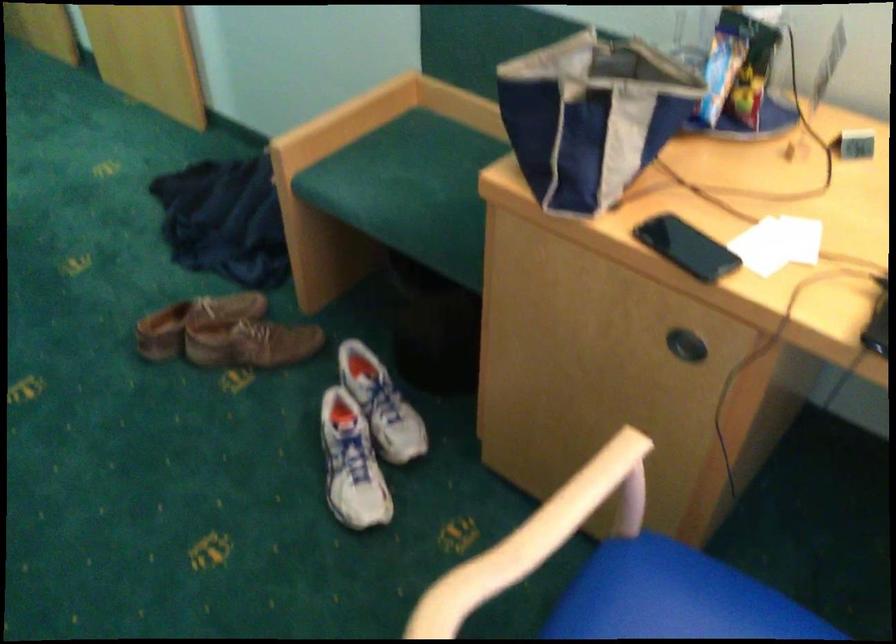
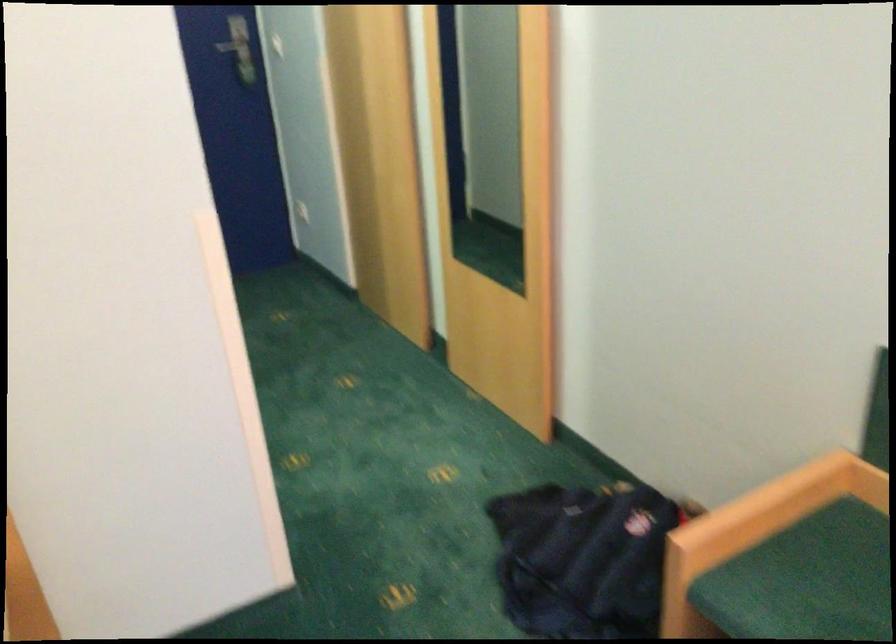
What movement of the cameraman would produce the second image?

The cameraman moved toward left, forward.